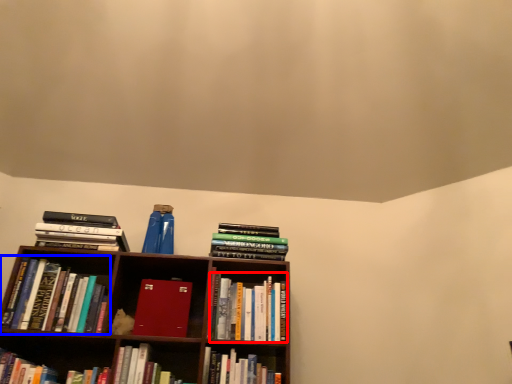
Question: Among these objects, which one is nearest to the camera, book (highlighted by a red box) or book (highlighted by a blue box)?

Choices:
 (A) book
 (B) book

Answer: (B)